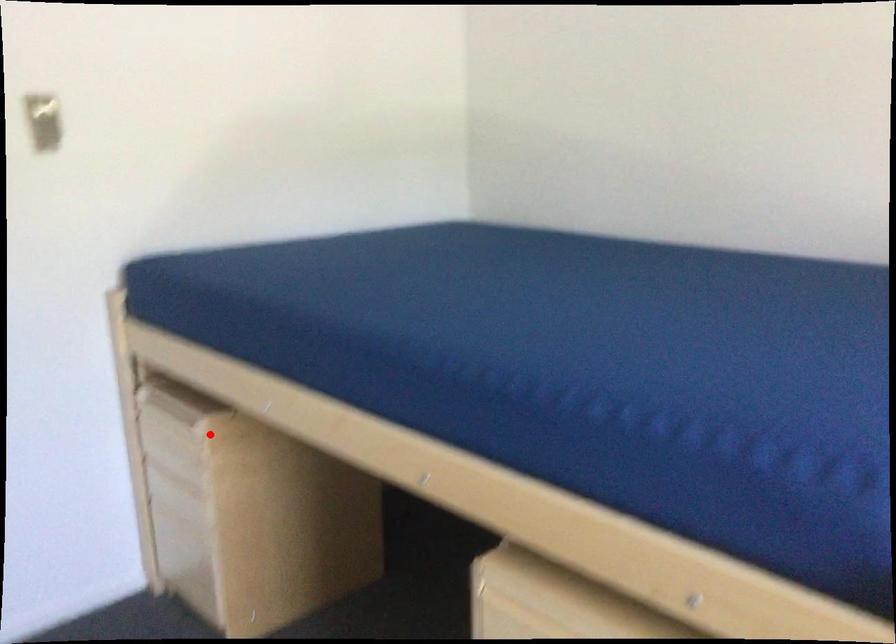
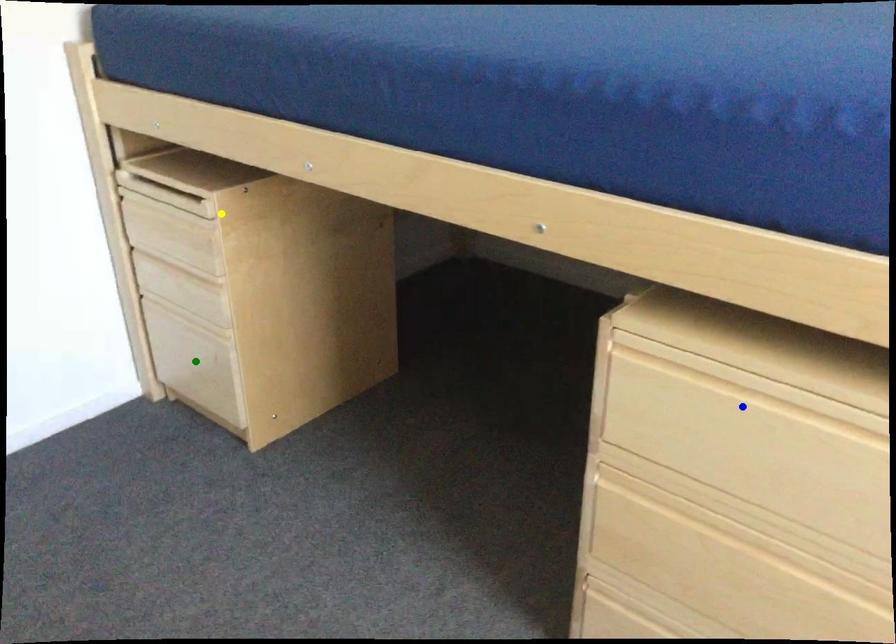
Question: I am providing you with two images of the same scene from different viewpoints. A red point is marked on the first image. You are given multiple points on the second image. Can you choose the point in image 2 that corresponds to the point in image 1?

Choices:
 (A) green point
 (B) yellow point
 (C) blue point

Answer: (B)